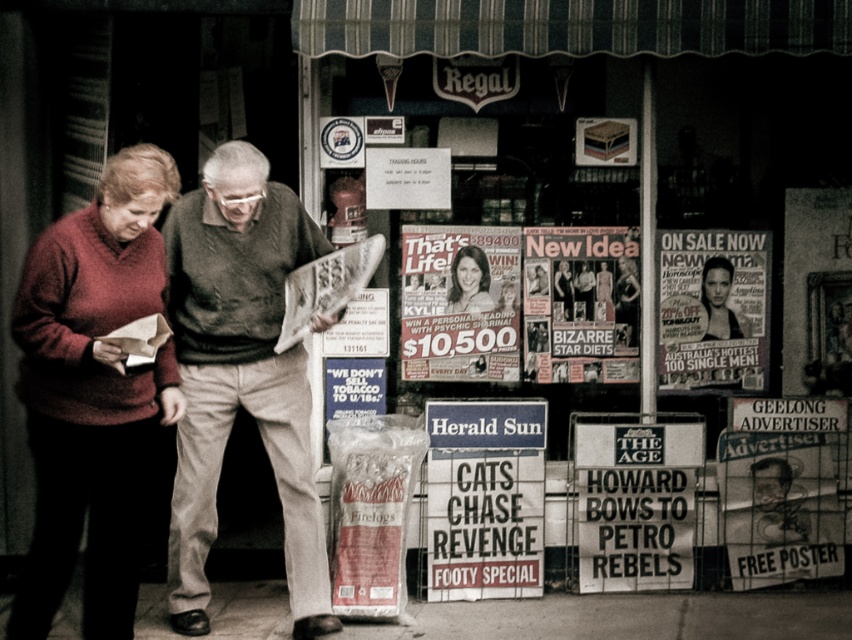
In the scene shown: Is dark green sweater at center taller than matte paper magazine at center?

Indeed, dark green sweater at center has a greater height compared to matte paper magazine at center.

How distant is dark green sweater at center from matte paper magazine at center?

dark green sweater at center is 4.85 feet from matte paper magazine at center.

This screenshot has height=640, width=852. What do you see at coordinates (240, 374) in the screenshot?
I see `dark green sweater at center` at bounding box center [240, 374].

Identify the location of dark green sweater at center. The width and height of the screenshot is (852, 640). [x=240, y=374].

Does matte paper poster at center have a lesser height compared to smooth black hair at center?

No.

Which of these two, matte paper poster at center or smooth black hair at center, stands shorter?

Standing shorter between the two is smooth black hair at center.

You are a GUI agent. You are given a task and a screenshot of the screen. Output one action in this format:
    pyautogui.click(x=<x>, y=<y>)
    Task: Click on the matte paper poster at center
    This screenshot has width=852, height=640.
    Given the screenshot: What is the action you would take?
    pyautogui.click(x=459, y=301)

Who is positioned more to the left, matte paper poster at center or smooth skin face at center?

matte paper poster at center

Can you confirm if matte paper poster at center is bigger than smooth skin face at center?

Correct, matte paper poster at center is larger in size than smooth skin face at center.

Does point (441, 362) lie in front of point (476, 289)?

That is False.

Find the location of a particular element. matte paper poster at center is located at coordinates (459, 301).